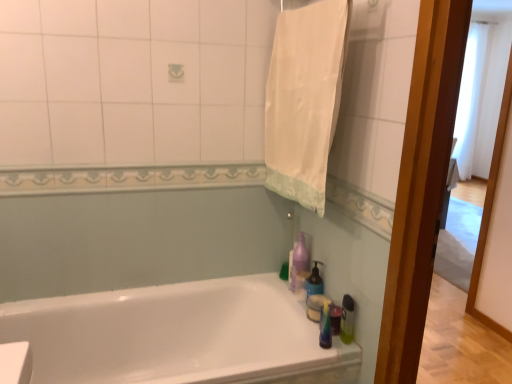
Question: Is green translucent bottle at right, which is the first cleaning product from front to back, a part of white cotton towel at upper right?

Choices:
 (A) yes
 (B) no

Answer: (B)

Question: Is white cotton towel at upper right with green translucent bottle at right, arranged as the 3th cleaning product when viewed from the back?

Choices:
 (A) yes
 (B) no

Answer: (B)

Question: Is white cotton towel at upper right positioned with its back to green translucent bottle at right, arranged as the 3th cleaning product when viewed from the back?

Choices:
 (A) no
 (B) yes

Answer: (A)

Question: Can you confirm if white cotton towel at upper right is shorter than green translucent bottle at right, arranged as the 3th cleaning product when viewed from the back?

Choices:
 (A) no
 (B) yes

Answer: (A)

Question: Does white cotton towel at upper right have a greater width compared to green translucent bottle at right, arranged as the 3th cleaning product when viewed from the back?

Choices:
 (A) no
 (B) yes

Answer: (B)

Question: Does white cotton towel at upper right have a larger size compared to green translucent bottle at right, which is the first cleaning product from front to back?

Choices:
 (A) yes
 (B) no

Answer: (A)

Question: Is translucent plastic soap dispenser at right, the 2th cleaning product when ordered from back to front, next to white glossy bathtub at lower center?

Choices:
 (A) no
 (B) yes

Answer: (A)

Question: Are translucent plastic soap dispenser at right, arranged as the second cleaning product when viewed from the front, and white glossy bathtub at lower center far apart?

Choices:
 (A) yes
 (B) no

Answer: (B)

Question: Is translucent plastic soap dispenser at right, the 2th cleaning product when ordered from back to front, positioned beyond the bounds of white glossy bathtub at lower center?

Choices:
 (A) yes
 (B) no

Answer: (A)

Question: Is translucent plastic soap dispenser at right, the 2th cleaning product when ordered from back to front, aimed at white glossy bathtub at lower center?

Choices:
 (A) yes
 (B) no

Answer: (A)

Question: From the image's perspective, is translucent plastic soap dispenser at right, arranged as the second cleaning product when viewed from the front, located beneath white glossy bathtub at lower center?

Choices:
 (A) yes
 (B) no

Answer: (B)

Question: Considering the relative sizes of translucent plastic soap dispenser at right, arranged as the second cleaning product when viewed from the front, and white glossy bathtub at lower center in the image provided, is translucent plastic soap dispenser at right, arranged as the second cleaning product when viewed from the front, shorter than white glossy bathtub at lower center?

Choices:
 (A) yes
 (B) no

Answer: (A)

Question: Is purple glossy bottle at upper right, the first cleaning product in the back-to-front sequence, turned away from white cotton towel at upper right?

Choices:
 (A) yes
 (B) no

Answer: (B)